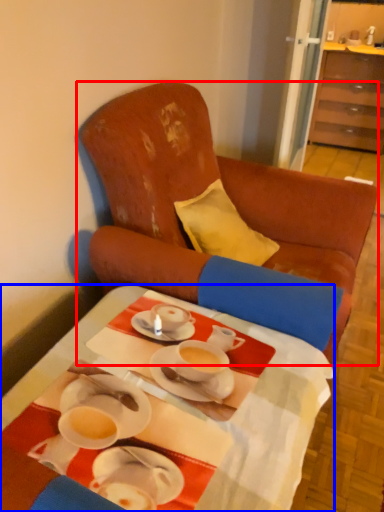
Question: Which point is closer to the camera, chair (highlighted by a red box) or desk (highlighted by a blue box)?

Choices:
 (A) chair
 (B) desk

Answer: (B)